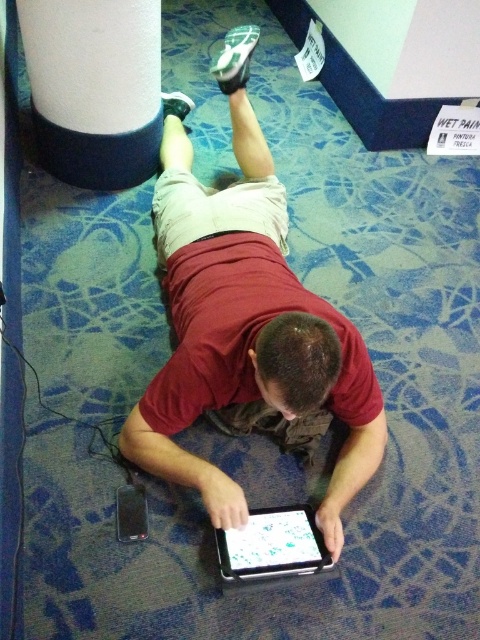
Which is more to the left, white matte cylinder at upper left or black glossy tablet at center?

white matte cylinder at upper left is more to the left.

Is point (153, 61) more distant than point (317, 536)?

Yes, it is.

What are the coordinates of `white matte cylinder at upper left` in the screenshot? It's located at (95, 88).

Which is more to the left, matte black tablet at center or white matte cylinder at upper left?

white matte cylinder at upper left

Does matte black tablet at center come in front of white matte cylinder at upper left?

Yes, it is in front of white matte cylinder at upper left.

Where is `matte black tablet at center`? The height and width of the screenshot is (640, 480). matte black tablet at center is located at coordinates (244, 320).

You are a GUI agent. You are given a task and a screenshot of the screen. Output one action in this format:
    pyautogui.click(x=<x>, y=<y>)
    Task: Click on the matte black tablet at center
    The width and height of the screenshot is (480, 640).
    Given the screenshot: What is the action you would take?
    pyautogui.click(x=244, y=320)

Who is more forward, (x=266, y=346) or (x=240, y=557)?

Point (x=266, y=346)

Is point (223, 397) positioned behind point (248, 564)?

That is True.

Is point (166, 241) closer to camera compared to point (254, 547)?

No.

You are a GUI agent. You are given a task and a screenshot of the screen. Output one action in this format:
    pyautogui.click(x=<x>, y=<y>)
    Task: Click on the matte black tablet at center
    This screenshot has width=480, height=640.
    Given the screenshot: What is the action you would take?
    pyautogui.click(x=244, y=320)